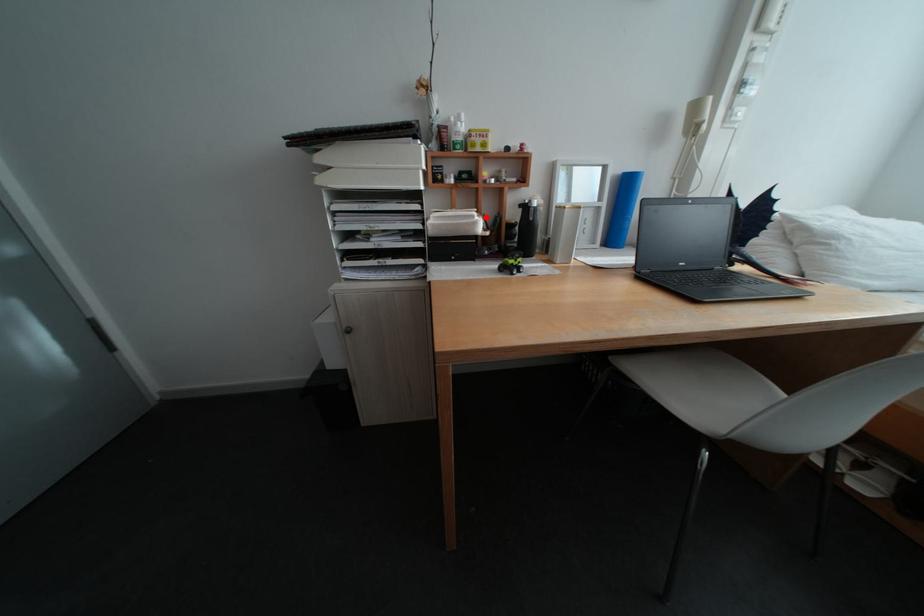
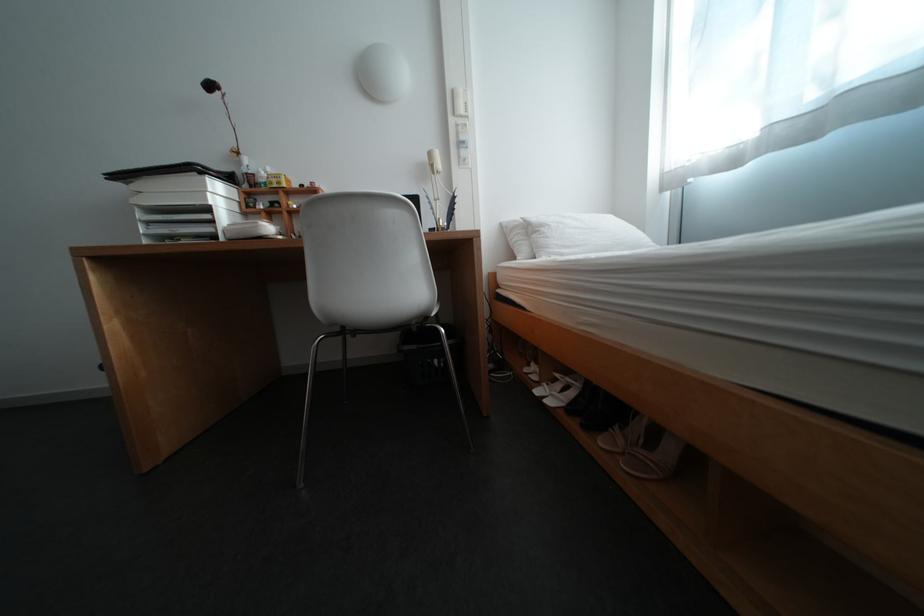
Where in the second image is the point corresponding to the highlighted location from the first image?

(270, 224)